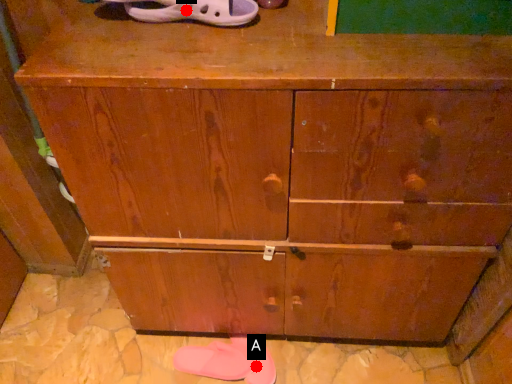
Question: Two points are circled on the image, labeled by A and B beside each circle. Which point is closer to the camera?

Choices:
 (A) A is closer
 (B) B is closer

Answer: (B)